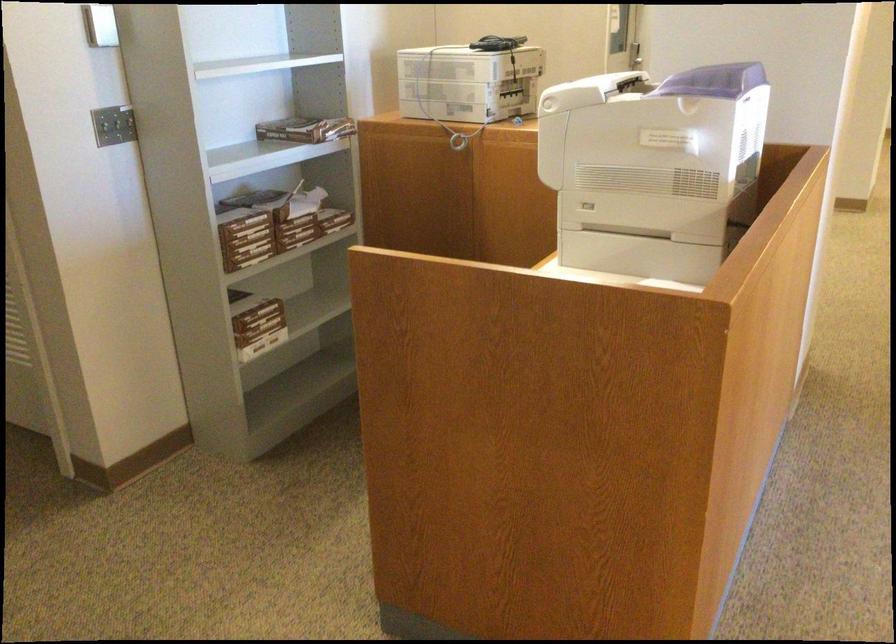
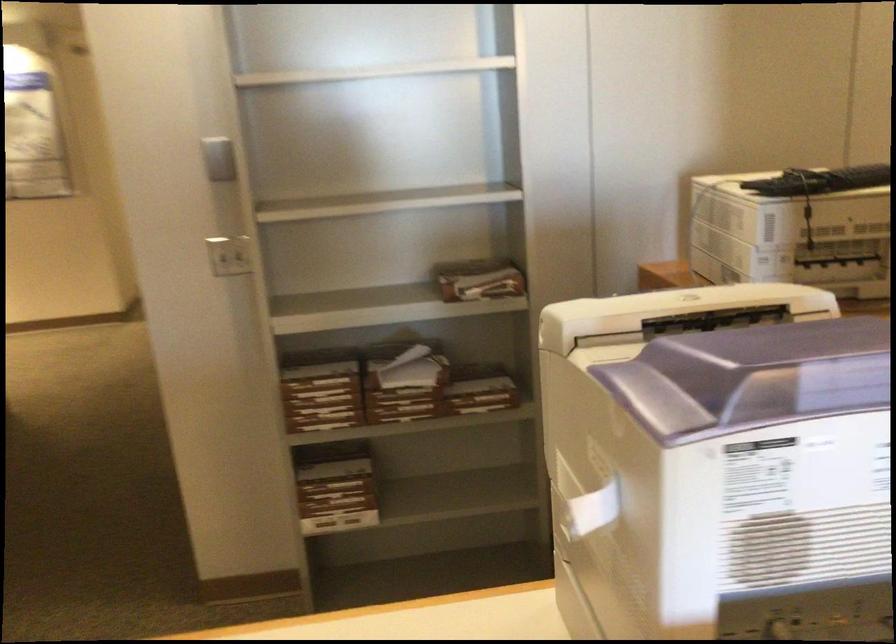
In the second image, find the point that corresponds to point (290, 216) in the first image.

(398, 389)